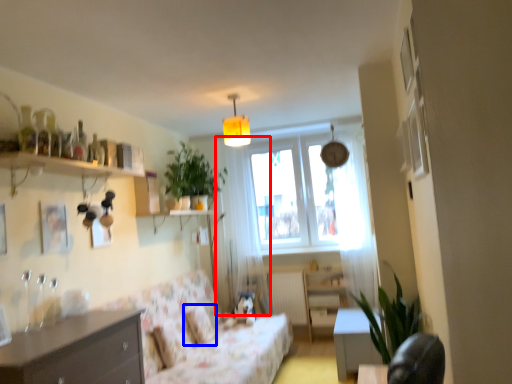
Question: Which of the following is the farthest to the observer, curtain (highlighted by a red box) or pillow (highlighted by a blue box)?

Choices:
 (A) curtain
 (B) pillow

Answer: (A)